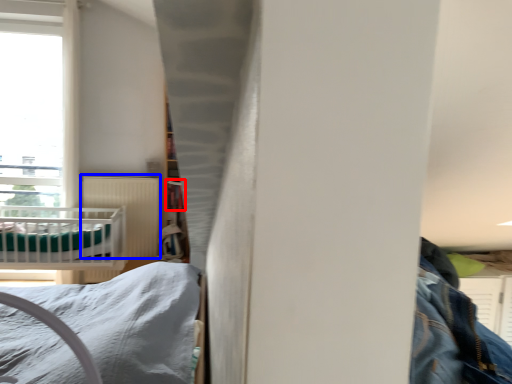
Question: Among these objects, which one is farthest to the camera, shelf (highlighted by a red box) or radiator (highlighted by a blue box)?

Choices:
 (A) shelf
 (B) radiator

Answer: (A)